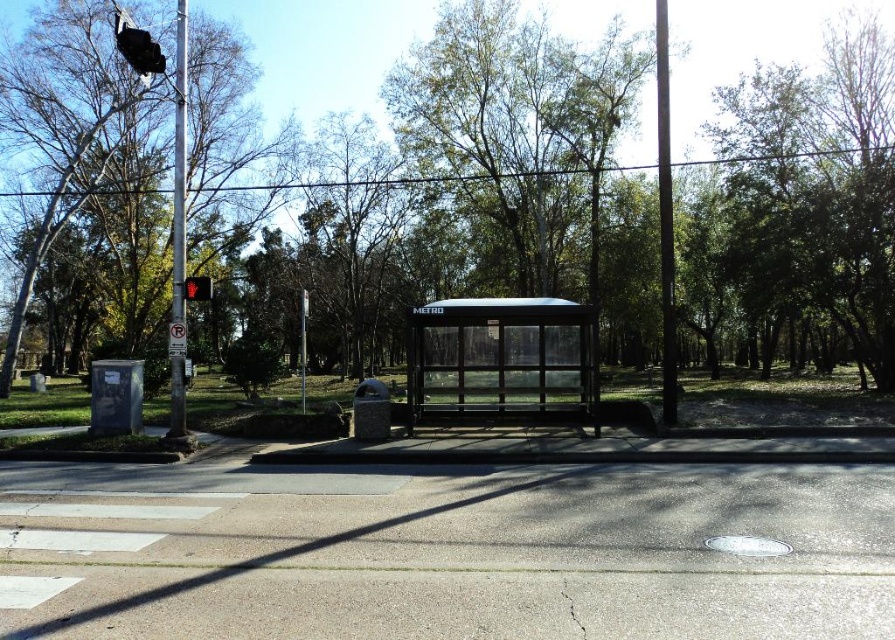
Question: Estimate the real-world distances between objects in this image. Which object is farther from the red glass traffic light at upper left?

Choices:
 (A) transparent glass bus stop at center
 (B) silver metallic pole at left
 (C) metallic pole at center
 (D) black metal pole at right

Answer: (C)

Question: Which of these objects is positioned farthest from the metallic pole at center?

Choices:
 (A) black metal pole at right
 (B) black plastic traffic light at upper left

Answer: (A)

Question: Can you confirm if metallic pole at center is positioned below metallic rectangular sign at upper center?

Choices:
 (A) no
 (B) yes

Answer: (B)

Question: Is silver metallic pole at left positioned behind black metal pole at right?

Choices:
 (A) yes
 (B) no

Answer: (B)

Question: Which of the following is the farthest from the observer?

Choices:
 (A) green leafy tree at left
 (B) red glass traffic light at upper left

Answer: (A)

Question: Is green leafy tree at left in front of black plastic traffic light at upper left?

Choices:
 (A) no
 (B) yes

Answer: (A)